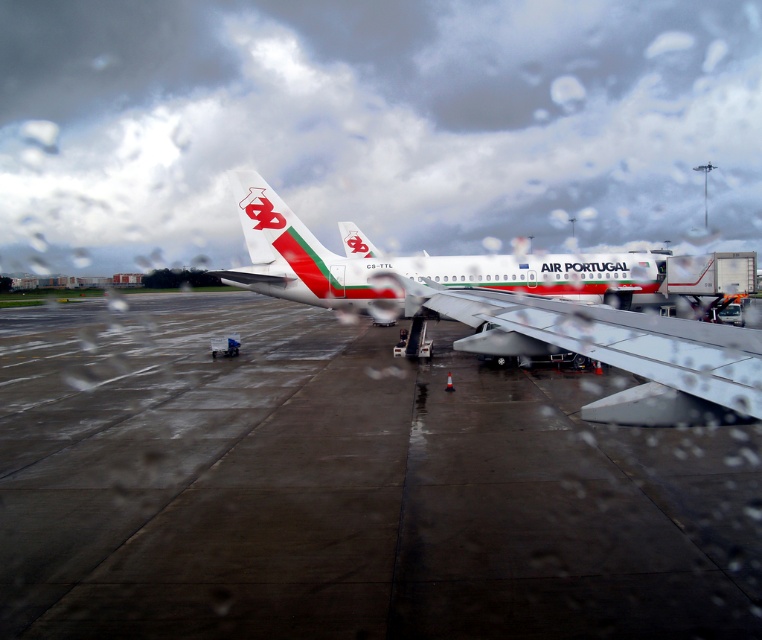
Question: Is concrete at center positioned behind white glossy airplane at center?

Choices:
 (A) no
 (B) yes

Answer: (A)

Question: Is concrete at center above white glossy airplane at center?

Choices:
 (A) yes
 (B) no

Answer: (B)

Question: Among these points, which one is farthest from the camera?

Choices:
 (A) (311, 262)
 (B) (514, 525)

Answer: (A)

Question: Can you confirm if concrete at center is smaller than white glossy airplane at center?

Choices:
 (A) no
 (B) yes

Answer: (B)